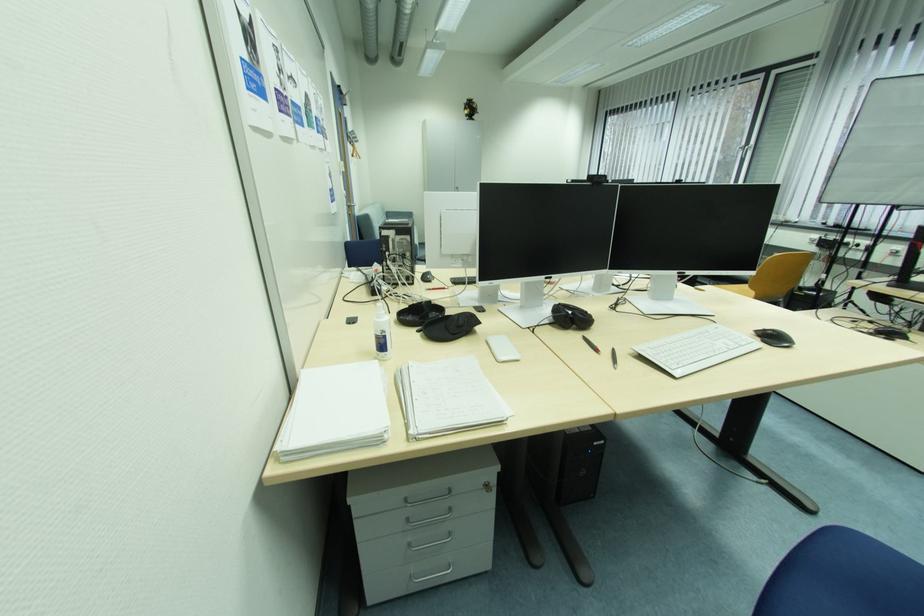
This screenshot has height=616, width=924. Find the location of `white smartphone`. white smartphone is located at coordinates (502, 349).